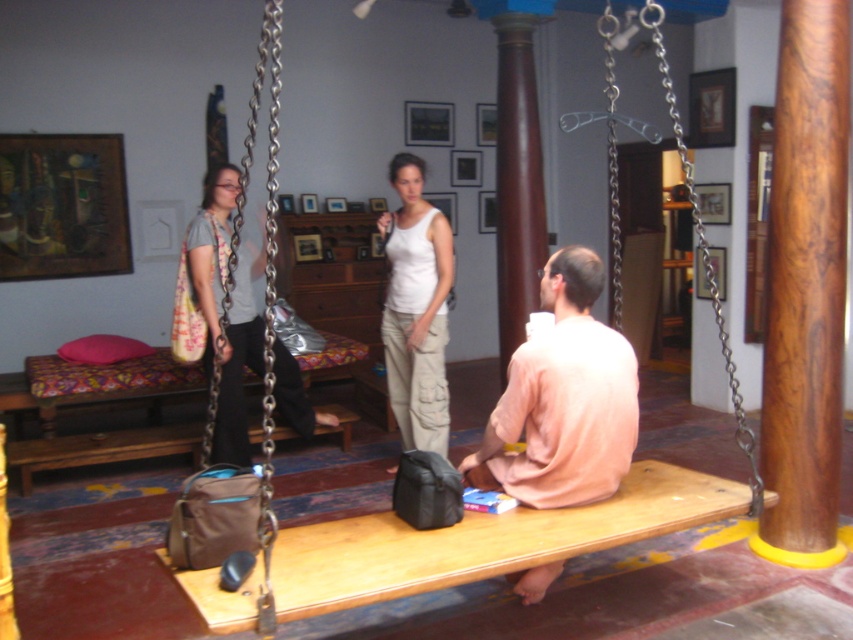
Based on the photo, you are planning to hang a decorative banner between the brown wood pole at center and the matte gray shirt at left. Which object should the banner be attached to if you want the banner to hang lower?

The banner should be attached to the brown wood pole at center because it has a smaller size compared to the matte gray shirt at left, allowing the banner to hang lower.

You are a drone operator trying to position a camera drone in the living room. The drone needs to be placed at coordinates exactly halfway between the brown wood pole at center and the wooden swing. What are the coordinates where you should position the drone?

The coordinates for the brown wood pole at center are given as point (805, 289). However, the exact coordinates of the wooden swing are not provided in the scene description. Without knowing the position of the wooden swing, it is impossible to calculate the halfway point between the two objects. Please provide the coordinates of the wooden swing to proceed.

You are planning to hang a new painting on the wall directly above the wooden swing at center. Based on its current position, where should you mark the spot for the nail?

The wooden swing at center is located at point (450,548), so you should mark the spot directly above this coordinate on the wall.